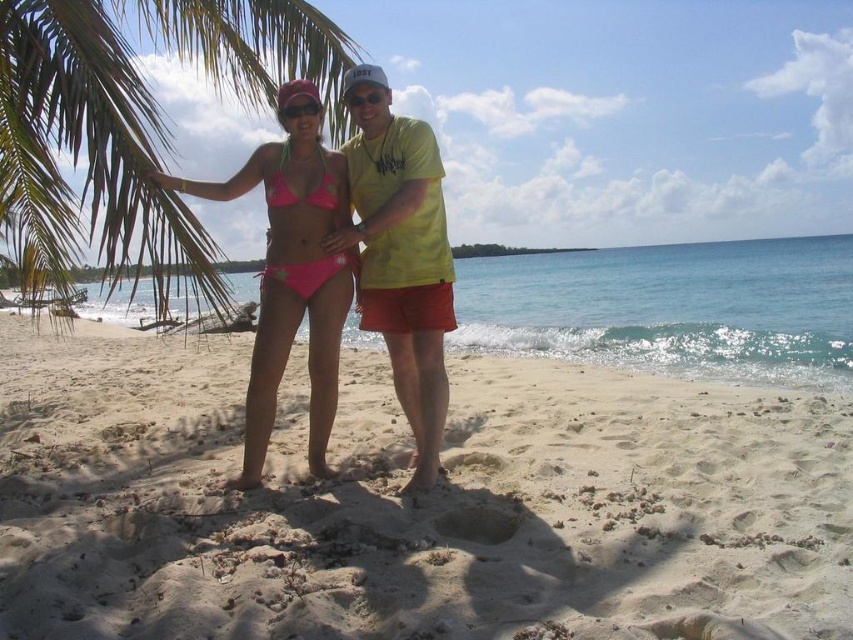
Is white sandy beach at center closer to the viewer compared to pink fabric bikini at center?

Yes, it is.

Between point (265, 600) and point (305, 268), which one is positioned in front?

Point (265, 600)

Image resolution: width=853 pixels, height=640 pixels. Describe the element at coordinates (412, 502) in the screenshot. I see `white sandy beach at center` at that location.

Where is `white sandy beach at center`? Image resolution: width=853 pixels, height=640 pixels. white sandy beach at center is located at coordinates point(412,502).

Between point (318, 609) and point (219, 22), which one is positioned behind?

Point (219, 22)

Who is more forward, (735, 541) or (163, 257)?

Point (735, 541)

This screenshot has width=853, height=640. I want to click on white sandy beach at center, so 412,502.

Can you confirm if yellow matte shirt at center is wider than pink fabric bikini at center?

No.

At what (x,y) coordinates should I click in order to perform the action: click on yellow matte shirt at center. Please return your answer as a coordinate pair (x, y). Looking at the image, I should click on (401, 256).

Identify the location of yellow matte shirt at center. (401, 256).